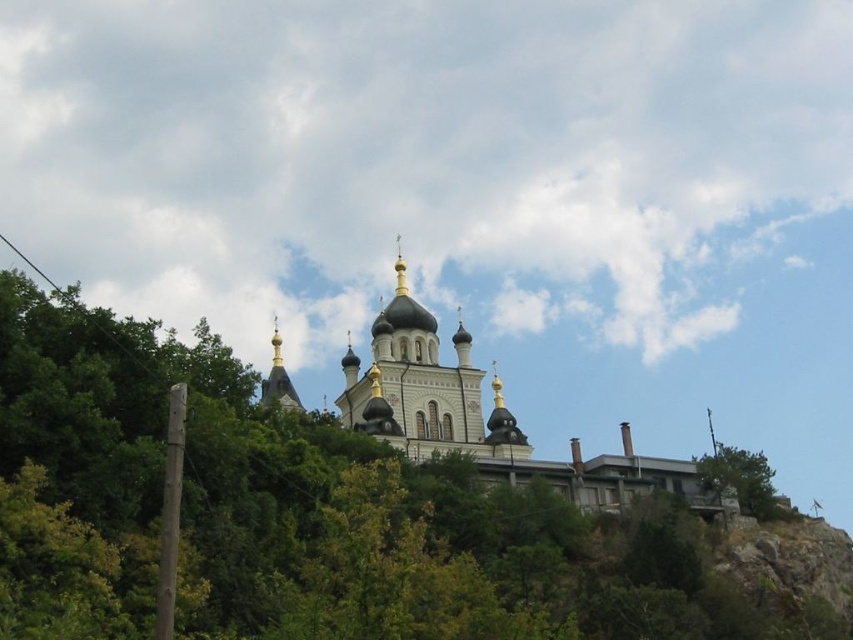
Between white stone church at upper center and green leafy tree at lower right, which one is positioned lower?

green leafy tree at lower right

Does point (476, 397) come in front of point (759, 488)?

No, it is behind (759, 488).

At what (x,y) coordinates should I click in order to perform the action: click on white stone church at upper center. Please return your answer as a coordinate pair (x, y). The height and width of the screenshot is (640, 853). Looking at the image, I should click on (482, 419).

Can you confirm if white stone church at upper center is smaller than white stone tower at center?

Actually, white stone church at upper center might be larger than white stone tower at center.

Is white stone church at upper center thinner than white stone tower at center?

No.

Is point (392, 301) behind point (374, 387)?

Yes, it is behind point (374, 387).

The height and width of the screenshot is (640, 853). I want to click on white stone church at upper center, so click(x=482, y=419).

Does white stone tower at center appear over green leafy tree at lower right?

Correct, white stone tower at center is located above green leafy tree at lower right.

Who is more distant from viewer, [368,381] or [715,456]?

Positioned behind is point [715,456].

The height and width of the screenshot is (640, 853). Find the location of `white stone tower at center`. white stone tower at center is located at coordinates [413, 381].